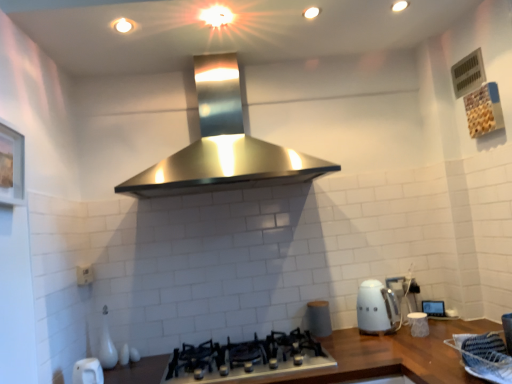
Question: Does white glossy kettle at lower right have a greater width compared to matte gray canister at center?

Choices:
 (A) no
 (B) yes

Answer: (B)

Question: Does white glossy kettle at lower right touch matte gray canister at center?

Choices:
 (A) yes
 (B) no

Answer: (B)

Question: Is matte gray canister at center at the back of white glossy kettle at lower right?

Choices:
 (A) no
 (B) yes

Answer: (A)

Question: From the image's perspective, would you say white glossy kettle at lower right is positioned over matte gray canister at center?

Choices:
 (A) no
 (B) yes

Answer: (B)

Question: Is white glossy kettle at lower right thinner than matte gray canister at center?

Choices:
 (A) yes
 (B) no

Answer: (B)

Question: In terms of height, does matte gray canister at center look taller or shorter compared to white glossy kettle at lower right?

Choices:
 (A) short
 (B) tall

Answer: (A)

Question: Relative to white glossy kettle at lower right, is matte gray canister at center in front or behind?

Choices:
 (A) behind
 (B) front

Answer: (A)

Question: Is matte gray canister at center bigger or smaller than white glossy kettle at lower right?

Choices:
 (A) small
 (B) big

Answer: (A)

Question: From a real-world perspective, is matte gray canister at center physically located above or below white glossy kettle at lower right?

Choices:
 (A) above
 (B) below

Answer: (B)

Question: Relative to white plastic electric outlet at lower left, is matte gray canister at center in front or behind?

Choices:
 (A) front
 (B) behind

Answer: (B)

Question: Considering the positions of matte gray canister at center and white plastic electric outlet at lower left in the image, is matte gray canister at center bigger or smaller than white plastic electric outlet at lower left?

Choices:
 (A) small
 (B) big

Answer: (B)

Question: Is point (307, 314) closer or farther from the camera than point (89, 269)?

Choices:
 (A) farther
 (B) closer

Answer: (A)

Question: From the image's perspective, is matte gray canister at center located above or below white plastic electric outlet at lower left?

Choices:
 (A) above
 (B) below

Answer: (B)

Question: Looking at their shapes, would you say satin black gas stove at center is wider or thinner than matte gray canister at center?

Choices:
 (A) wide
 (B) thin

Answer: (A)

Question: Is satin black gas stove at center inside or outside of matte gray canister at center?

Choices:
 (A) inside
 (B) outside

Answer: (B)